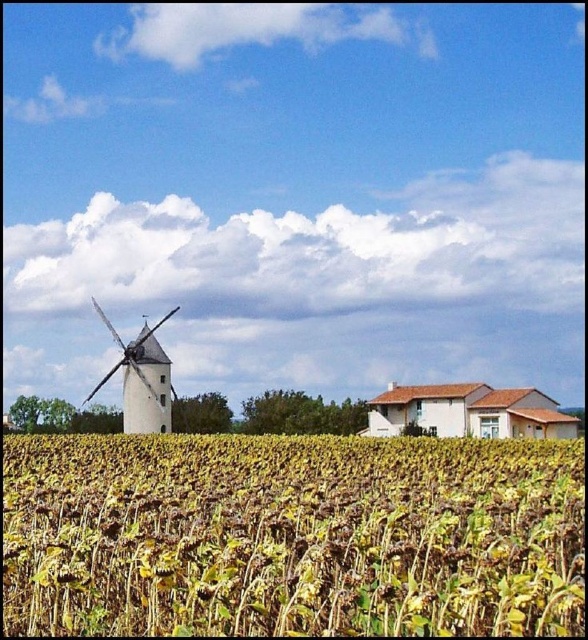
Does yellow-green sunflower field at lower center appear over white matte windmill at left?

Yes.

Who is taller, yellow-green sunflower field at lower center or white matte windmill at left?

white matte windmill at left is taller.

At what (x,y) coordinates should I click in order to perform the action: click on yellow-green sunflower field at lower center. Please return your answer as a coordinate pair (x, y). Image resolution: width=588 pixels, height=640 pixels. Looking at the image, I should click on (292, 536).

I want to click on yellow-green sunflower field at lower center, so click(x=292, y=536).